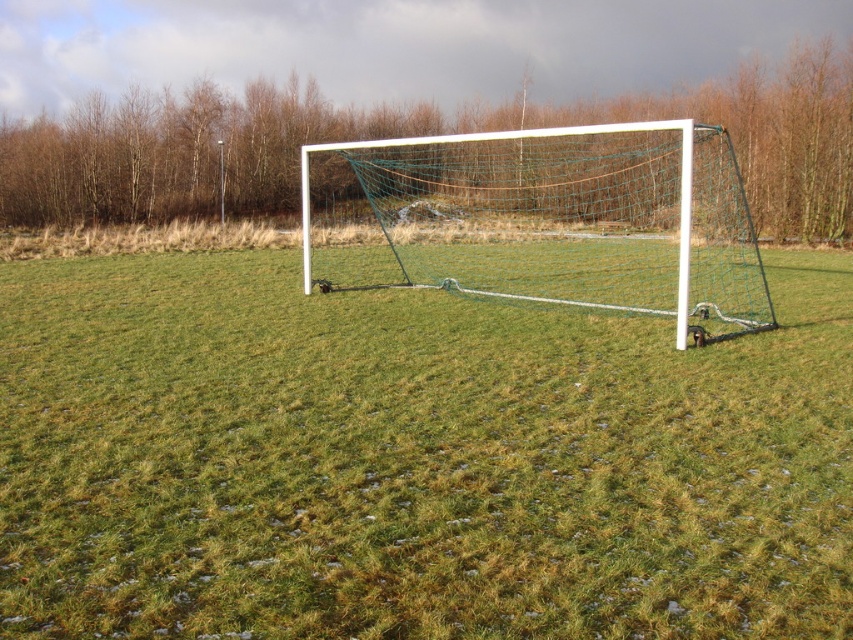
You are a soccer coach preparing for a training session. You notice the green grass at center and the white plastic goal at center in the image. Which object occupies a larger area in the scene?

The white plastic goal at center occupies a larger area than the green grass at center because the green grass at center is described as smaller.

You are a soccer player standing at the edge of the field. You see the green grass at center and the white plastic goal at center. Which object is located to the right when facing the goal?

The white plastic goal at center is located to the right of the green grass at center.

You are a drone operator trying to capture a photo of the soccer goal. You need to position your drone exactly at the center of the green grass at center. According to the image coordinates, what are the exact coordinates where you should place the drone?

The exact coordinates for the green grass at center are at point (413, 460), so you should place the drone at those coordinates to capture the photo.